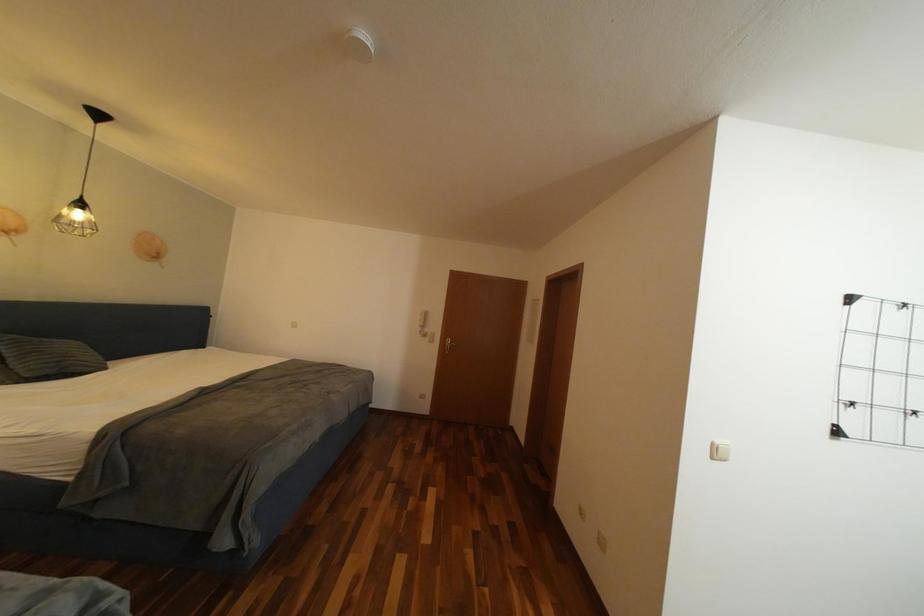
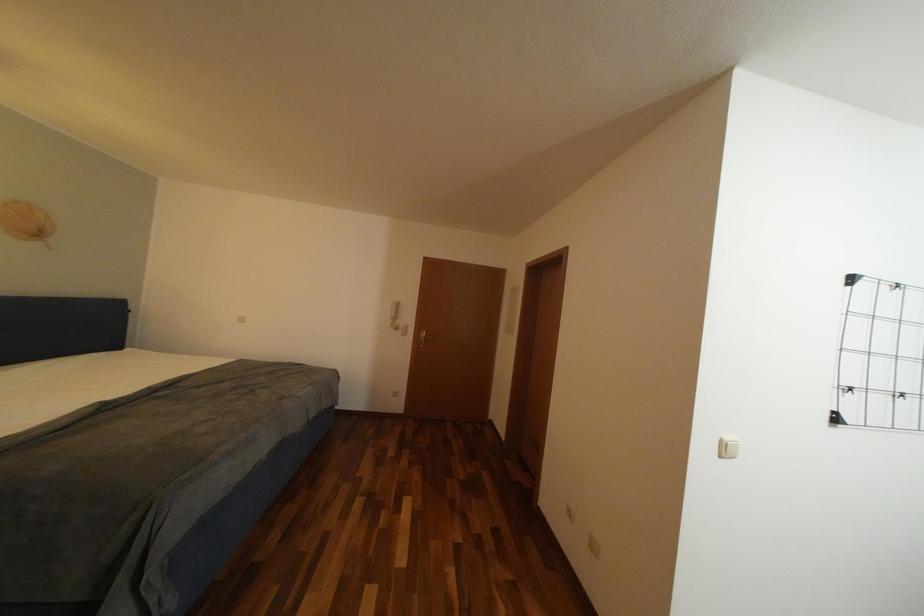
Question: What movement of the cameraman would produce the second image?

Choices:
 (A) Left
 (B) Right
 (C) Forward
 (D) Backward

Answer: (C)